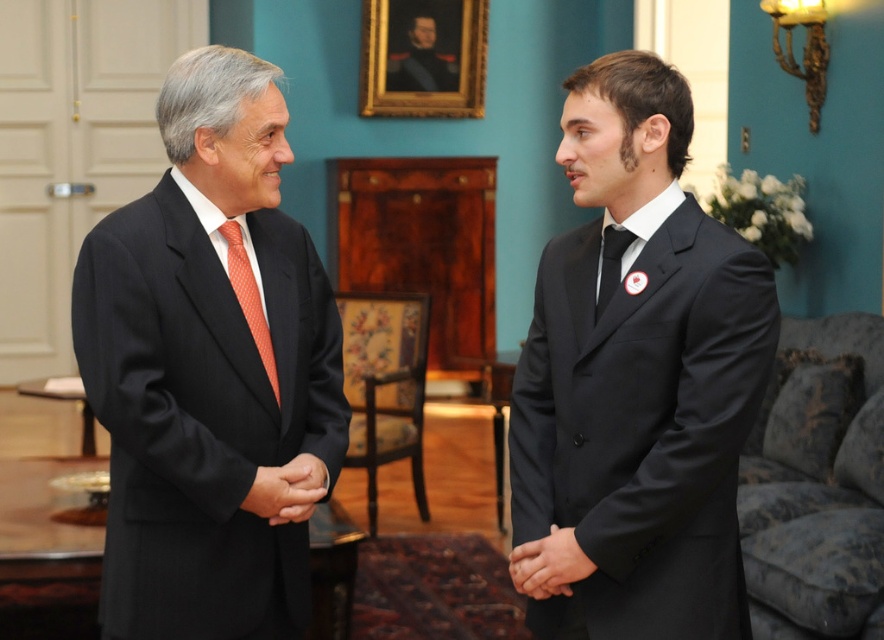
Question: Among these objects, which one is farthest from the camera?

Choices:
 (A) black satin tie at center
 (B) matte black suit at center
 (C) orange textured tie at left
 (D) dark blue uniform at upper center

Answer: (D)

Question: Estimate the real-world distances between objects in this image. Which object is farther from the dark blue uniform at upper center?

Choices:
 (A) black smooth hand at center
 (B) black satin tie at center
 (C) matte black suit at center

Answer: (A)

Question: Observing the image, what is the correct spatial positioning of matte black suit at center in reference to black smooth hand at center?

Choices:
 (A) above
 (B) below

Answer: (A)

Question: Can you confirm if orange textured tie at left is smaller than black satin tie at center?

Choices:
 (A) no
 (B) yes

Answer: (A)

Question: Does black smooth hands at center appear on the right side of black smooth hand at center?

Choices:
 (A) no
 (B) yes

Answer: (B)

Question: Which point is farther to the camera?

Choices:
 (A) (276, 76)
 (B) (561, 528)
 (C) (615, 268)
 (D) (539, 484)

Answer: (D)